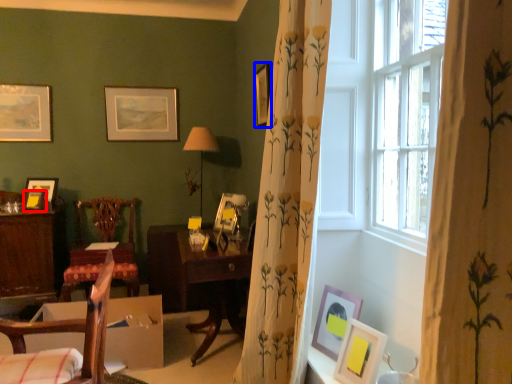
Question: Among these objects, which one is nearest to the camera, picture frame (highlighted by a red box) or picture frame (highlighted by a blue box)?

Choices:
 (A) picture frame
 (B) picture frame

Answer: (B)